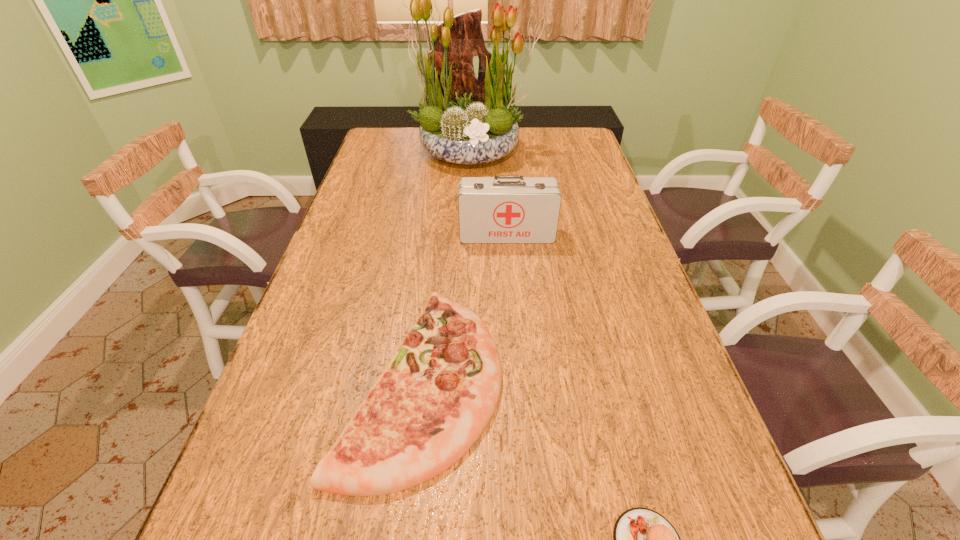
Where is `vacant region at the left edge of the desktop`? vacant region at the left edge of the desktop is located at coordinates (371, 197).

Locate an element on the screen. The height and width of the screenshot is (540, 960). vacant space at the right edge of the desktop is located at coordinates (577, 217).

The image size is (960, 540). What are the coordinates of `empty space that is in between the pizza and the flower arrangement` in the screenshot? It's located at (447, 266).

Image resolution: width=960 pixels, height=540 pixels. I want to click on free spot between the pizza and the farthest object, so click(447, 266).

Identify which object is located as the second nearest to the patty. Please provide its 2D coordinates. Your answer should be formatted as a tuple, i.e. [(x, y)], where the tuple contains the x and y coordinates of a point satisfying the conditions above.

[(502, 209)]

Locate which object ranks second in proximity to the tallest object. Please provide its 2D coordinates. Your answer should be formatted as a tuple, i.e. [(x, y)], where the tuple contains the x and y coordinates of a point satisfying the conditions above.

[(440, 390)]